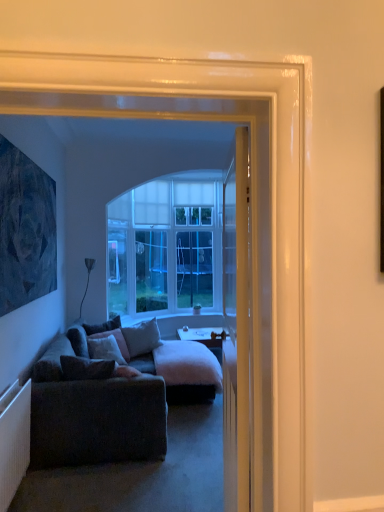
Question: From a real-world perspective, relative to smooth wooden desk at center, is gray fabric pillow at center, the 3th pillow from the front, vertically above or below?

Choices:
 (A) above
 (B) below

Answer: (A)

Question: Is gray fabric pillow at center, the 3th pillow from the front, to the left or to the right of smooth wooden desk at center in the image?

Choices:
 (A) right
 (B) left

Answer: (B)

Question: Estimate the real-world distances between objects in this image. Which object is closer to the white fluffy blanket at center?

Choices:
 (A) velvet gray pillow at center, which appears as the fourth pillow when viewed from the front
 (B) dark gray fabric couch at lower left
 (C) velvet gray pillow at center, marked as the 3th pillow in a back-to-front arrangement
 (D) white glossy door at center
 (E) white textured radiator at lower left

Answer: (C)

Question: Based on their relative distances, which object is nearer to the white glossy door at center?

Choices:
 (A) dark gray fabric couch at lower left
 (B) dark blue textured painting at left
 (C) smooth wooden desk at center
 (D) gray fabric pillow at center, which is the second pillow from back to front
 (E) white textured radiator at lower left

Answer: (E)